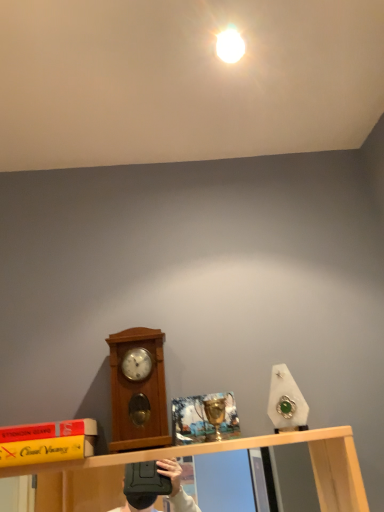
Where is `free space behind white glossy light bulb at upper center`? This screenshot has width=384, height=512. free space behind white glossy light bulb at upper center is located at coordinates pos(233,103).